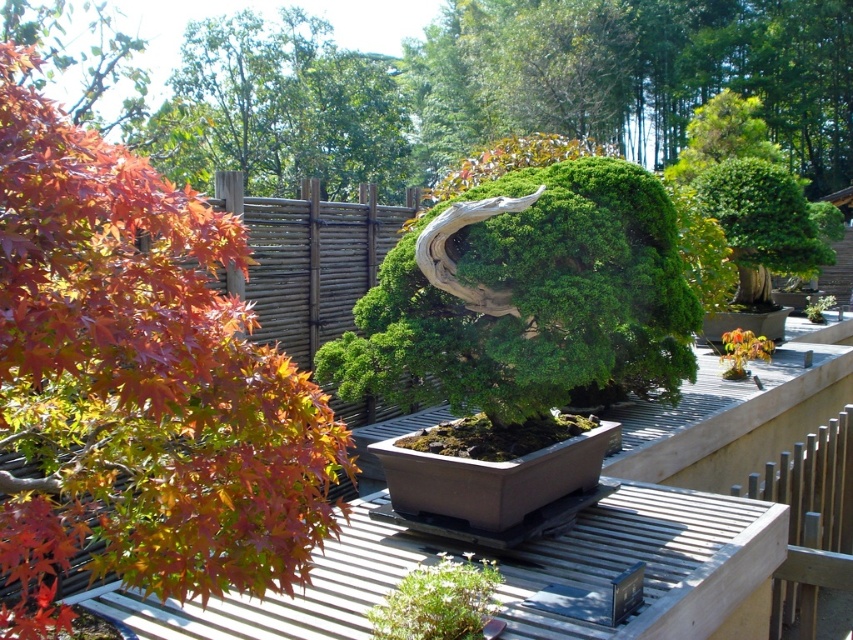
Is green matte bonsai tree at center closer to camera compared to green textured bonsai tree at center?

Yes.

Which is behind, point (161, 369) or point (630, 176)?

The point (630, 176) is behind.

Between point (143, 157) and point (369, 387), which one is positioned behind?

The point (369, 387) is behind.

At what (x,y) coordinates should I click in order to perform the action: click on green matte bonsai tree at center. Please return your answer as a coordinate pair (x, y). Looking at the image, I should click on (138, 381).

How far apart are green textured bonsai tree at center and green textured bush at upper right?

green textured bonsai tree at center is 5.06 meters from green textured bush at upper right.

Which is behind, point (558, 195) or point (817, 260)?

Positioned behind is point (817, 260).

Is point (392, 365) closer to viewer compared to point (711, 173)?

Yes, point (392, 365) is closer to viewer.

The image size is (853, 640). I want to click on green textured bonsai tree at center, so click(x=526, y=298).

Between green matte bonsai tree at center and green textured bush at upper right, which one appears on the left side from the viewer's perspective?

green matte bonsai tree at center is more to the left.

Which of these two, green matte bonsai tree at center or green textured bush at upper right, stands taller?

With more height is green textured bush at upper right.

Which is behind, point (67, 499) or point (802, 205)?

Positioned behind is point (802, 205).

At what (x,y) coordinates should I click in order to perform the action: click on green matte bonsai tree at center. Please return your answer as a coordinate pair (x, y). The height and width of the screenshot is (640, 853). Looking at the image, I should click on (138, 381).